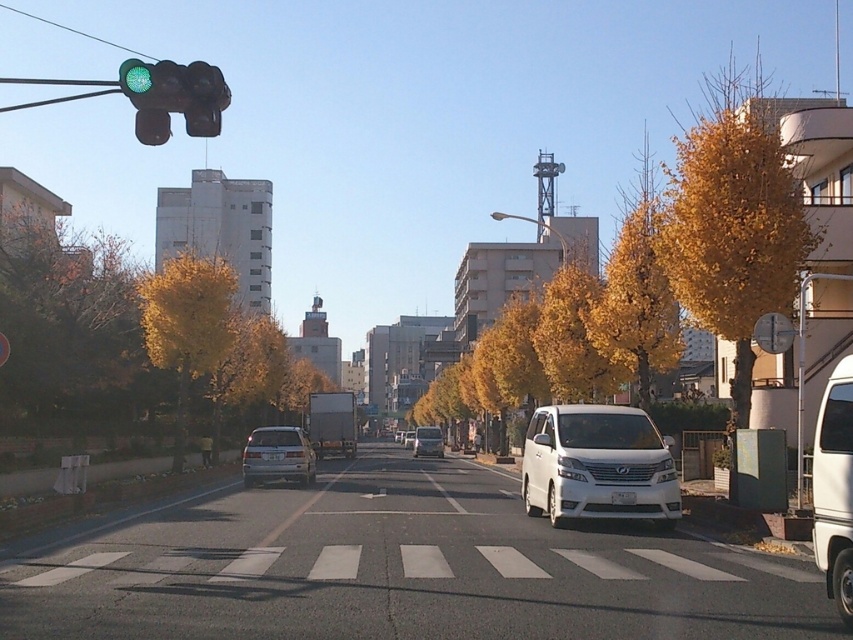
Question: Which object appears closest to the camera in this image?

Choices:
 (A) green glass traffic light at upper left
 (B) white painted lines at crosswalk center
 (C) matte black van at center

Answer: (A)

Question: Which is farther from the white glossy sedan at center?

Choices:
 (A) satin silver sedan at center
 (B) white asphalt line at center

Answer: (B)

Question: Among these points, which one is farthest from the camera?

Choices:
 (A) (453, 502)
 (B) (622, 572)

Answer: (A)

Question: Is white glossy car at center thinner than yellow/golden leaves at center?

Choices:
 (A) no
 (B) yes

Answer: (A)

Question: In this image, where is golden textured tree at left located relative to matte black van at center?

Choices:
 (A) above
 (B) below

Answer: (A)

Question: Observing the image, what is the correct spatial positioning of green glass traffic light at upper left in reference to satin silver sedan at center?

Choices:
 (A) left
 (B) right

Answer: (A)